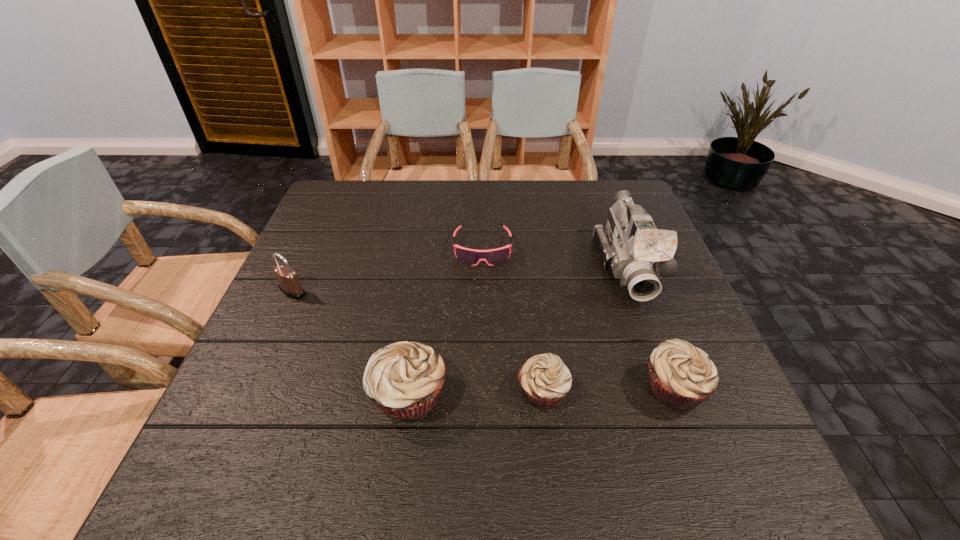
Image resolution: width=960 pixels, height=540 pixels. What are the coordinates of `free point that satisfies the following two spatial constraints: 1. on the front-facing side of the goggles; 2. on the left side of the second tallest muffin` in the screenshot? It's located at (483, 388).